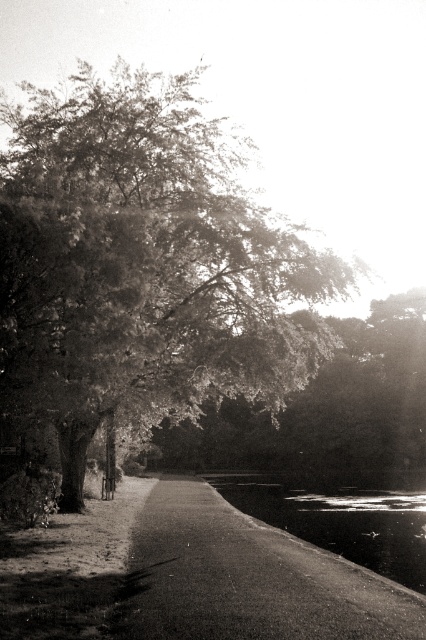
Can you confirm if grainy black tree at upper left is shorter than smooth asphalt path at center?

In fact, grainy black tree at upper left may be taller than smooth asphalt path at center.

Is grainy black tree at upper left positioned before smooth asphalt path at center?

No.

Locate an element on the screen. grainy black tree at upper left is located at coordinates (143, 262).

This screenshot has width=426, height=640. I want to click on grainy black tree at upper left, so click(143, 262).